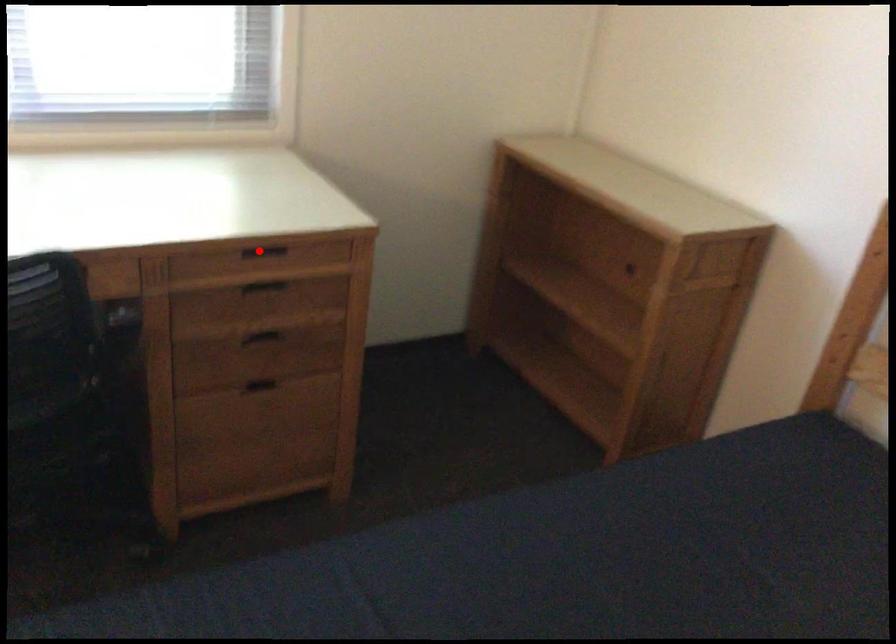
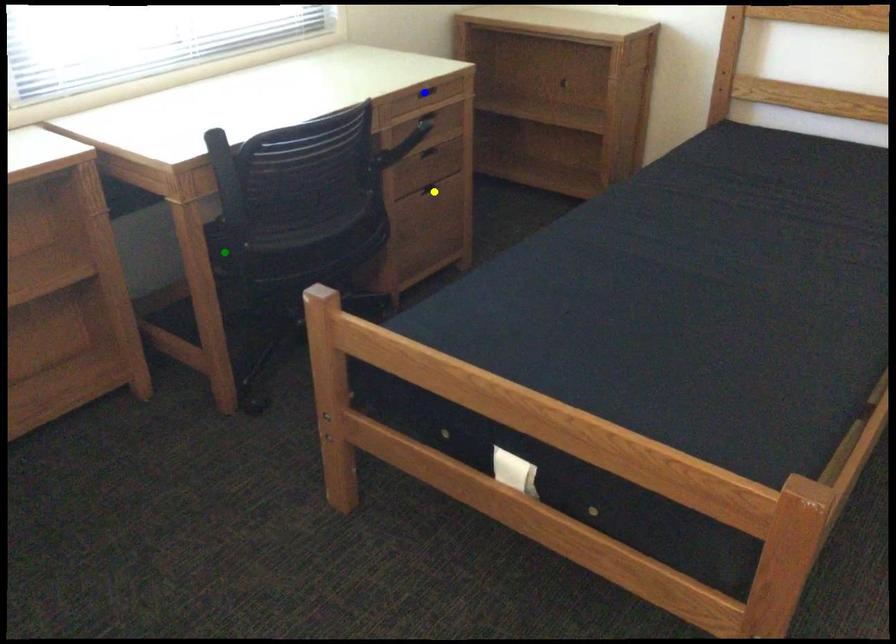
Question: I am providing you with two images of the same scene from different viewpoints. A red point is marked on the first image. You are given multiple points on the second image. Which point in image 2 is actually the same real-world point as the red point in image 1?

Choices:
 (A) green point
 (B) blue point
 (C) yellow point

Answer: (B)